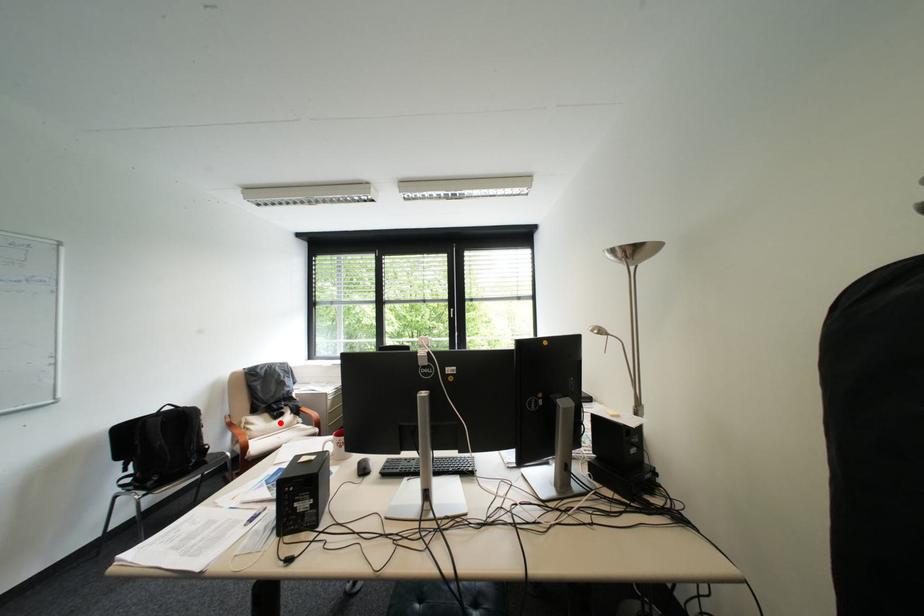
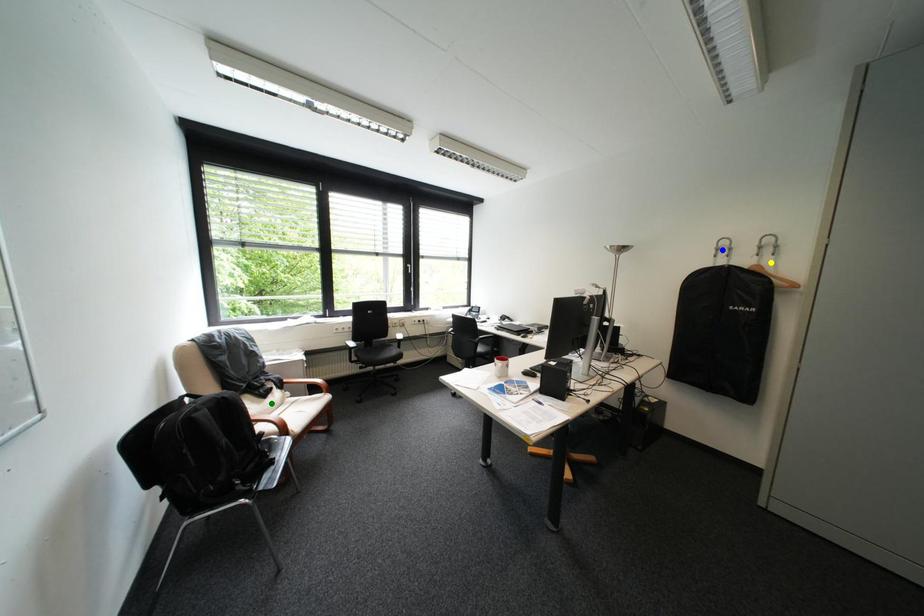
Question: I am providing you with two images of the same scene from different viewpoints. A red point is marked on the first image. You are given multiple points on the second image. Which spot in image 2 lines up with the point in image 1?

Choices:
 (A) blue point
 (B) yellow point
 (C) green point

Answer: (C)